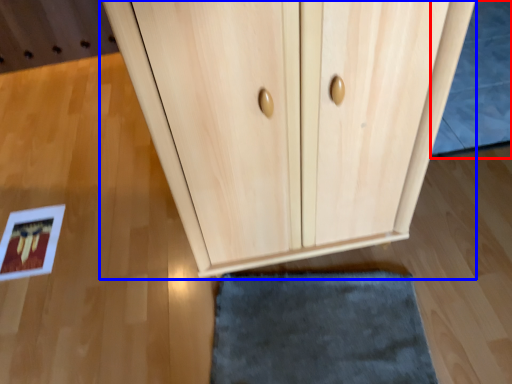
Question: Which object appears closest to the camera in this image, bath mat (highlighted by a red box) or cupboard (highlighted by a blue box)?

Choices:
 (A) bath mat
 (B) cupboard

Answer: (B)